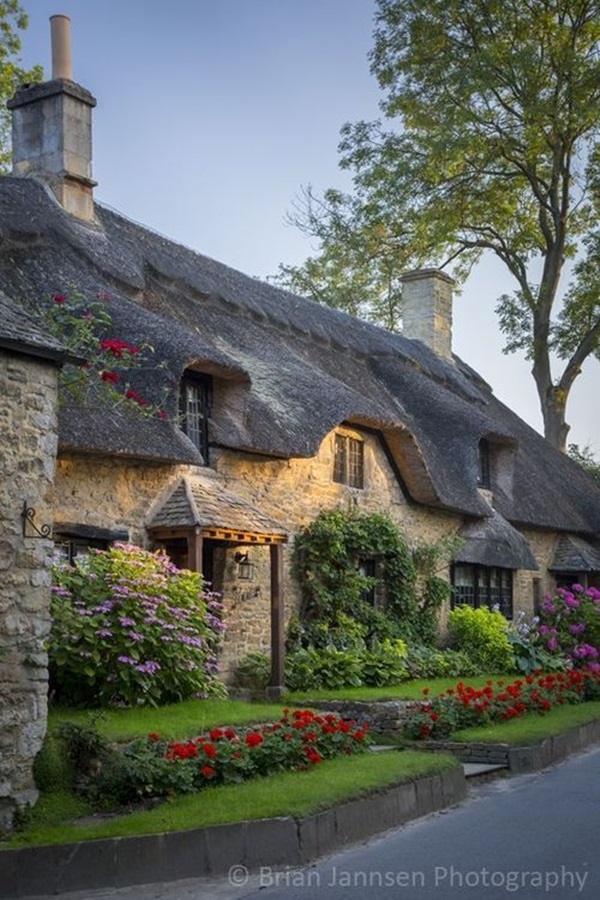
The image size is (600, 900). Find the location of `light`. light is located at coordinates (253, 569).